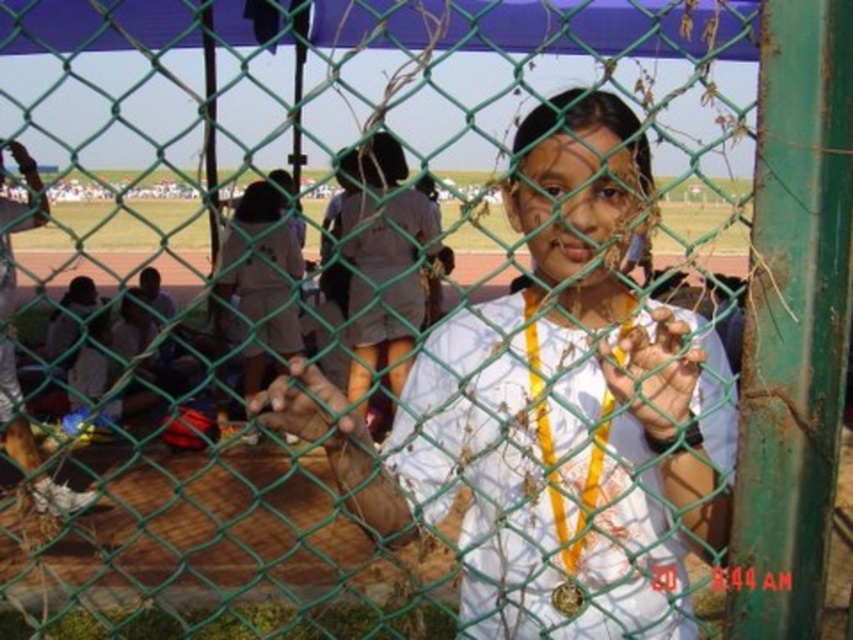
Is smooth skin hand at center to the left of smooth brown hand at center from the viewer's perspective?

In fact, smooth skin hand at center is to the right of smooth brown hand at center.

Can you confirm if smooth skin hand at center is taller than smooth brown hand at center?

Indeed, smooth skin hand at center has a greater height compared to smooth brown hand at center.

Locate an element on the screen. The image size is (853, 640). smooth skin hand at center is located at coordinates (654, 372).

Can you confirm if white matte shirt at center is taller than smooth brown hand at center?

Yes, white matte shirt at center is taller than smooth brown hand at center.

Is white matte shirt at center in front of smooth brown hand at center?

Yes, it is in front of smooth brown hand at center.

Between point (566, 260) and point (286, 396), which one is positioned behind?

Positioned behind is point (566, 260).

Locate an element on the screen. The width and height of the screenshot is (853, 640). white matte shirt at center is located at coordinates (564, 412).

Who is higher up, white matte shirt at center or smooth skin hand at center?

smooth skin hand at center is higher up.

Who is more distant from viewer, (643, 317) or (646, 394)?

Point (643, 317)

What are the coordinates of `white matte shirt at center` in the screenshot? It's located at (564, 412).